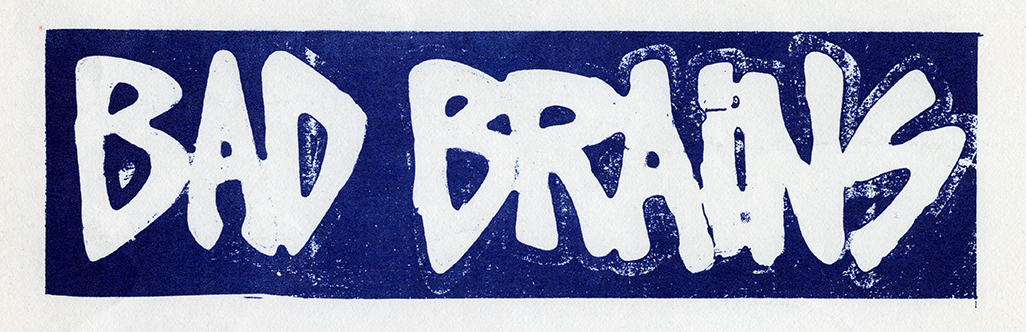
Identify the location of white paint. (142, 124), (213, 168), (338, 172), (429, 163), (554, 163), (655, 170), (716, 163), (768, 172), (891, 159).